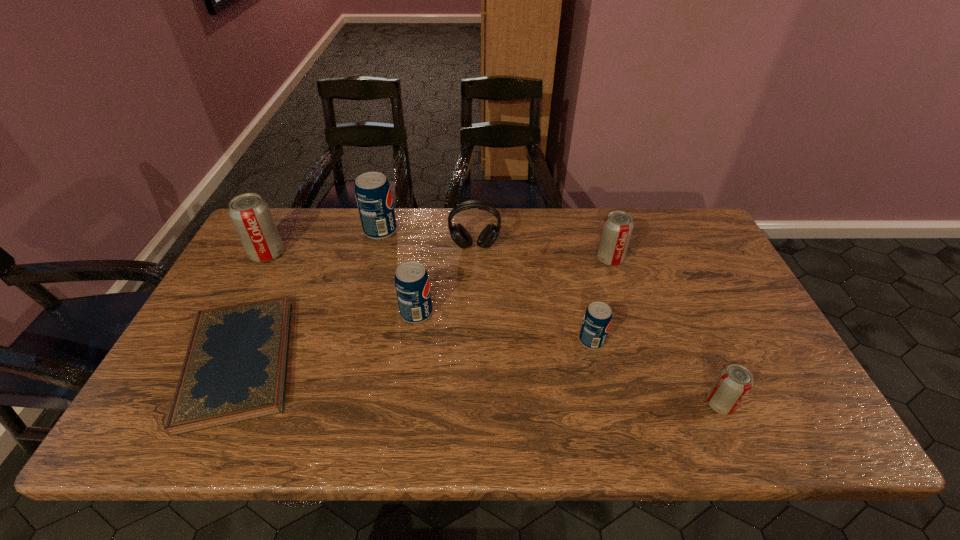
The image size is (960, 540). What are the coordinates of `the second soda can from left to right` in the screenshot? It's located at (373, 194).

Identify the location of the farthest soda can. The image size is (960, 540). (373, 194).

The width and height of the screenshot is (960, 540). I want to click on the leftmost soda can, so click(x=250, y=214).

Where is `the leftmost gray soda can`? the leftmost gray soda can is located at coordinates (250, 214).

Find the location of a particular element. The image size is (960, 540). headset is located at coordinates pos(490,233).

Where is `gray headset`? gray headset is located at coordinates (490, 233).

Locate an element on the screen. This screenshot has width=960, height=540. the second object from right to left is located at coordinates (617, 228).

Where is `the second soda can from right to left`? This screenshot has width=960, height=540. the second soda can from right to left is located at coordinates (617, 228).

In order to click on the second farthest blue pop in this screenshot , I will do `click(412, 285)`.

At what (x,y) coordinates should I click in order to perform the action: click on the third nearest soda can. Please return your answer as a coordinate pair (x, y). This screenshot has width=960, height=540. Looking at the image, I should click on (412, 285).